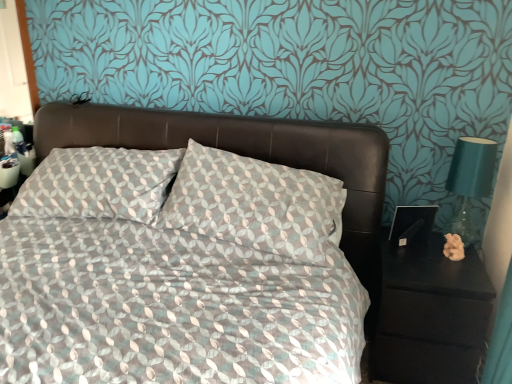
Where is `blank space above black matte nightstand at right (from a real-world perspective)`? blank space above black matte nightstand at right (from a real-world perspective) is located at coordinates (428, 264).